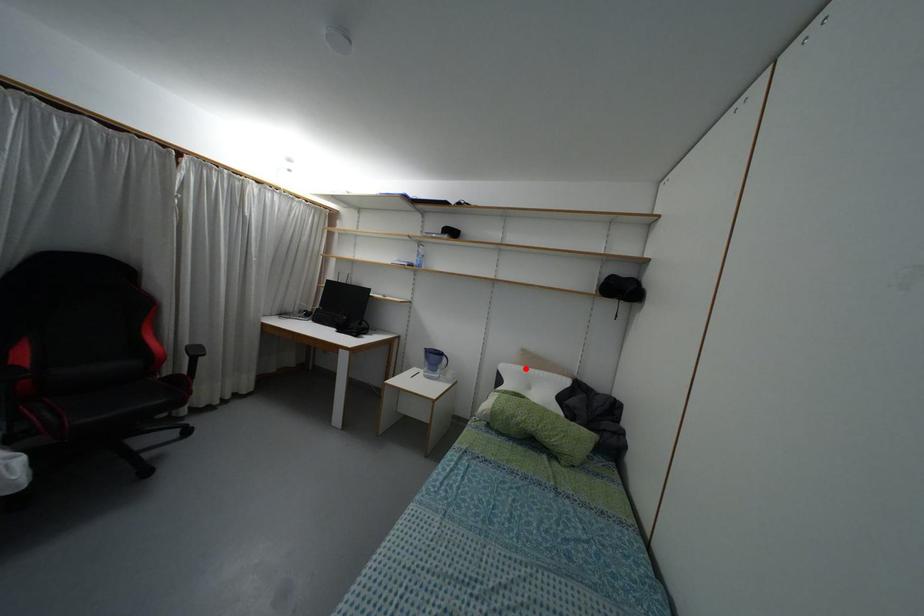
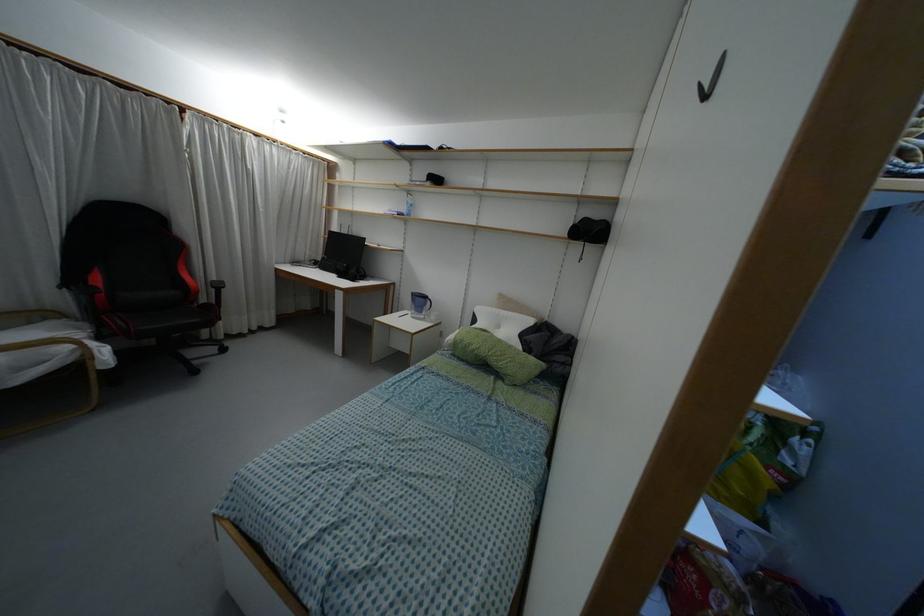
Question: I am providing you with two images of the same scene from different viewpoints. A red point is shown in image1. For the corresponding object point in image2, is it positioned nearer or farther from the camera?

Choices:
 (A) Nearer
 (B) Farther

Answer: (A)